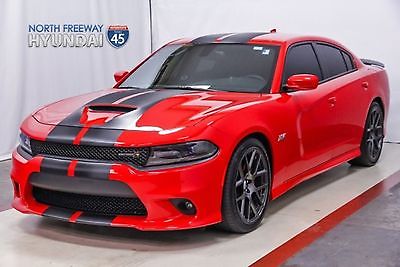
Identify the location of concrete floor. The width and height of the screenshot is (400, 267). (342, 248), (2, 180).